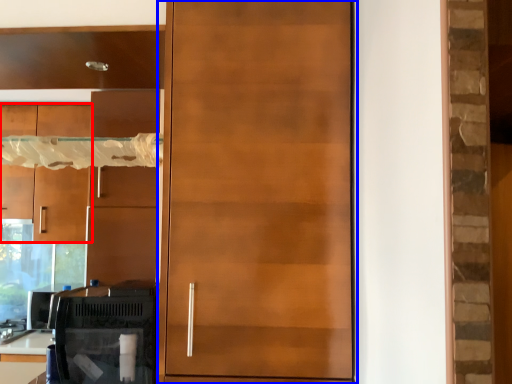
Question: Which object is further to the camera taking this photo, cabinetry (highlighted by a red box) or door (highlighted by a blue box)?

Choices:
 (A) cabinetry
 (B) door

Answer: (A)